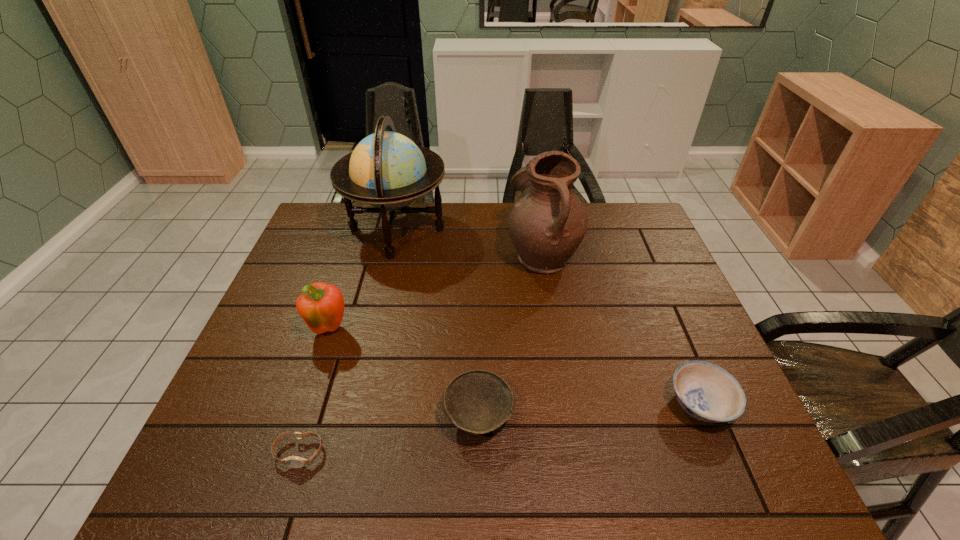
Locate an element on the screen. This screenshot has height=540, width=960. free space between the fifth object from left to right and the shortest object is located at coordinates (420, 354).

Where is `free space that is in between the globe and the fourth tallest object`? The height and width of the screenshot is (540, 960). free space that is in between the globe and the fourth tallest object is located at coordinates 438,323.

The image size is (960, 540). In order to click on object that is the third closest to the pitcher in this screenshot , I will do `click(478, 401)`.

Choose which object is the third nearest neighbor to the shorter bowl. Please provide its 2D coordinates. Your answer should be formatted as a tuple, i.e. [(x, y)], where the tuple contains the x and y coordinates of a point satisfying the conditions above.

[(387, 170)]

This screenshot has width=960, height=540. I want to click on blank space that satisfies the following two spatial constraints: 1. at the spout of the fifth object from left to right; 2. on the right side of the right bowl, so (x=567, y=404).

In order to click on free space that satisfies the following two spatial constraints: 1. on the front side of the pepper; 2. on the left side of the third shortest object in this screenshot , I will do `click(302, 416)`.

Identify the location of vacant area in the image that satisfies the following two spatial constraints: 1. on the surface of the third shortest object; 2. on the left side of the globe. The image size is (960, 540). (353, 416).